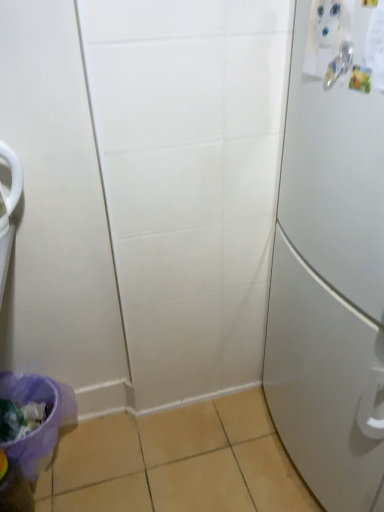
Question: Is purple fabric potty at lower left spatially inside white matte refrigerator at right, or outside of it?

Choices:
 (A) outside
 (B) inside

Answer: (A)

Question: Considering the positions of point (6, 451) and point (276, 342), is point (6, 451) closer or farther from the camera than point (276, 342)?

Choices:
 (A) closer
 (B) farther

Answer: (A)

Question: Which of these objects is positioned farthest from the purple fabric potty at lower left?

Choices:
 (A) translucent plastic bottle at lower left
 (B) silver metallic door handle at upper right
 (C) white matte refrigerator at right

Answer: (B)

Question: Which object is positioned closest to the purple fabric potty at lower left?

Choices:
 (A) silver metallic door handle at upper right
 (B) translucent plastic bottle at lower left
 (C) white matte refrigerator at right

Answer: (B)